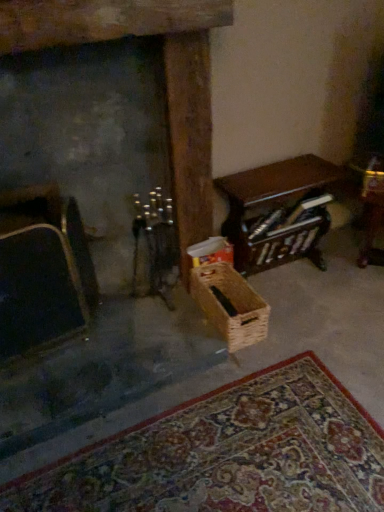
Locate an element on the screen. Image resolution: width=384 pixels, height=512 pixels. free point below velvet black armchair at left (from a real-world perspective) is located at coordinates (57, 351).